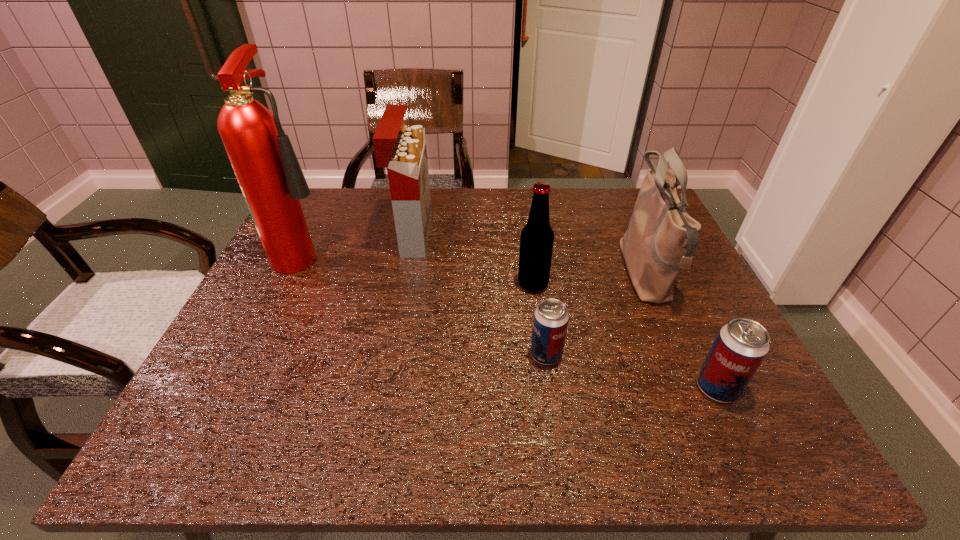
Please point out where to position a new beer can on the left to maintain spacing. Please provide its 2D coordinates. Your answer should be formatted as a tuple, i.e. [(x, y)], where the tuple contains the x and y coordinates of a point satisfying the conditions above.

[(396, 325)]